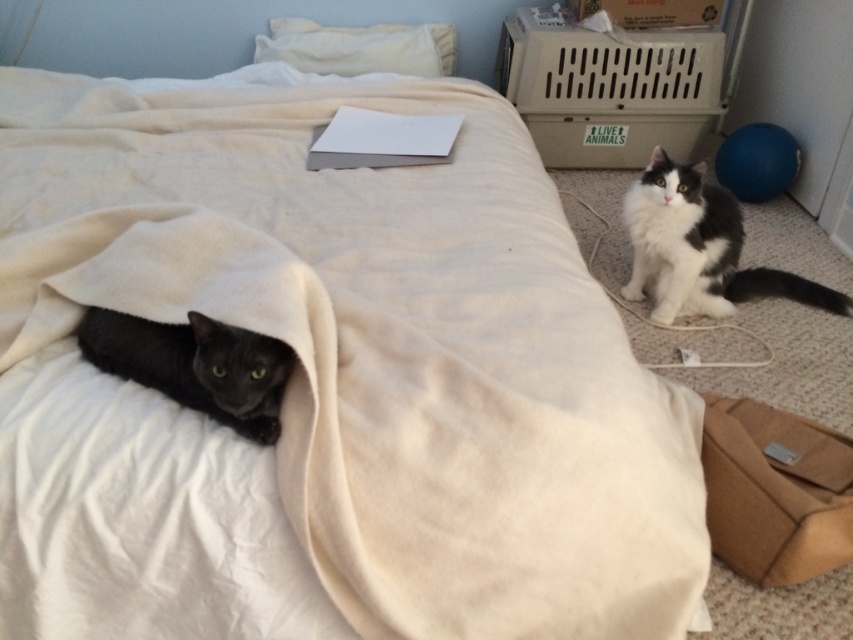
Can you confirm if shiny black cat at lower left is shorter than white soft pillow at upper center?

Yes, shiny black cat at lower left is shorter than white soft pillow at upper center.

Consider the image. Between shiny black cat at lower left and white soft pillow at upper center, which one has less height?

shiny black cat at lower left

Which is in front, point (262, 442) or point (265, 49)?

Point (262, 442) is in front.

Identify the location of shiny black cat at lower left. Image resolution: width=853 pixels, height=640 pixels. (195, 365).

Between point (724, 540) and point (277, 388), which one is positioned in front?

Point (277, 388) is in front.

Which is above, brown fabric bag at lower right or shiny black cat at lower left?

shiny black cat at lower left is higher up.

The width and height of the screenshot is (853, 640). Find the location of `brown fabric bag at lower right`. brown fabric bag at lower right is located at coordinates (775, 492).

Locate an element on the screen. Image resolution: width=853 pixels, height=640 pixels. brown fabric bag at lower right is located at coordinates (775, 492).

Can you confirm if white fluffy cat at right is shorter than shiny black cat at lower left?

In fact, white fluffy cat at right may be taller than shiny black cat at lower left.

Does white fluffy cat at right have a lesser width compared to shiny black cat at lower left?

No, white fluffy cat at right is not thinner than shiny black cat at lower left.

Between point (637, 257) and point (111, 365), which one is positioned in front?

Point (111, 365) is more forward.

You are a GUI agent. You are given a task and a screenshot of the screen. Output one action in this format:
    pyautogui.click(x=<x>, y=<y>)
    Task: Click on the white fluffy cat at right
    The image size is (853, 640).
    Given the screenshot: What is the action you would take?
    pyautogui.click(x=699, y=248)